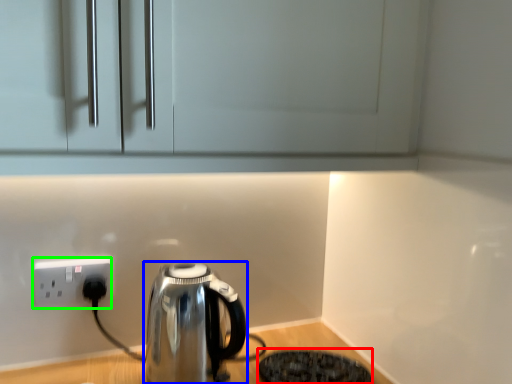
Question: Which is nearer to the appliance (highlighted by a red box)? kettle (highlighted by a blue box) or power plugs and sockets (highlighted by a green box).

Choices:
 (A) kettle
 (B) power plugs and sockets

Answer: (A)